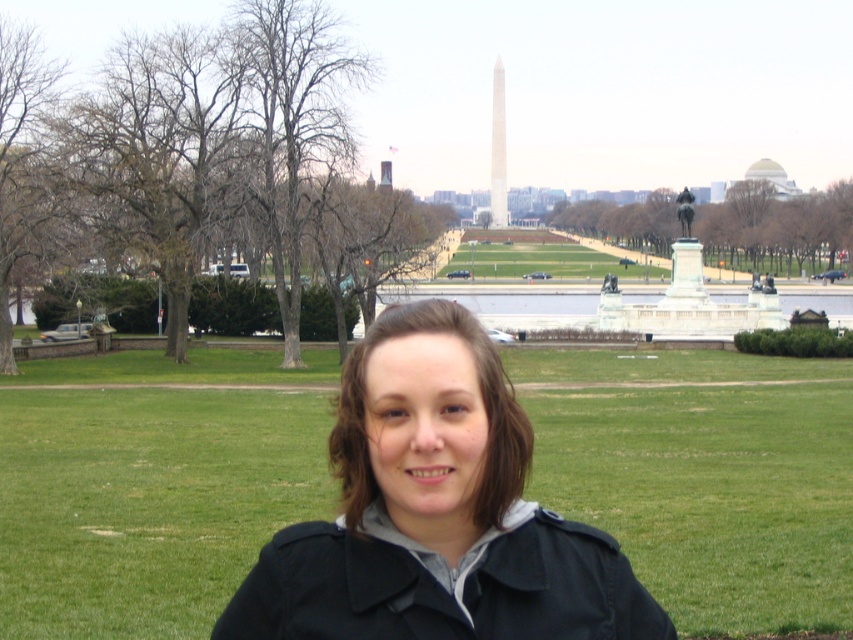
Question: Is black matte jacket at center to the left of bronze statue at center from the viewer's perspective?

Choices:
 (A) yes
 (B) no

Answer: (A)

Question: Which of the following is the farthest from the observer?

Choices:
 (A) (642, 330)
 (B) (495, 468)

Answer: (A)

Question: Which of the following is the farthest from the observer?

Choices:
 (A) black matte jacket at center
 (B) bronze statue at center

Answer: (B)

Question: Is black matte jacket at center above bronze statue at center?

Choices:
 (A) no
 (B) yes

Answer: (A)

Question: Can you confirm if black matte jacket at center is thinner than bronze statue at center?

Choices:
 (A) no
 (B) yes

Answer: (B)